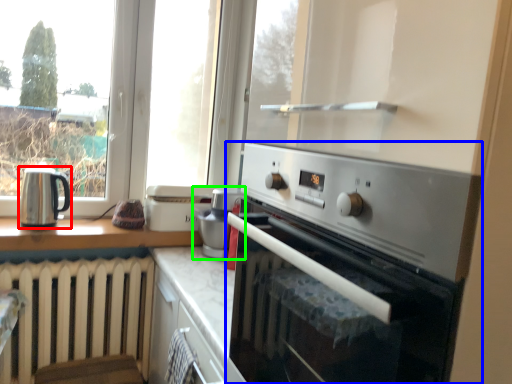
Question: Which object is the farthest from kitchen appliance (highlighted by a red box)? Choose among these: home appliance (highlighted by a blue box) or appliance (highlighted by a green box).

Choices:
 (A) home appliance
 (B) appliance

Answer: (A)